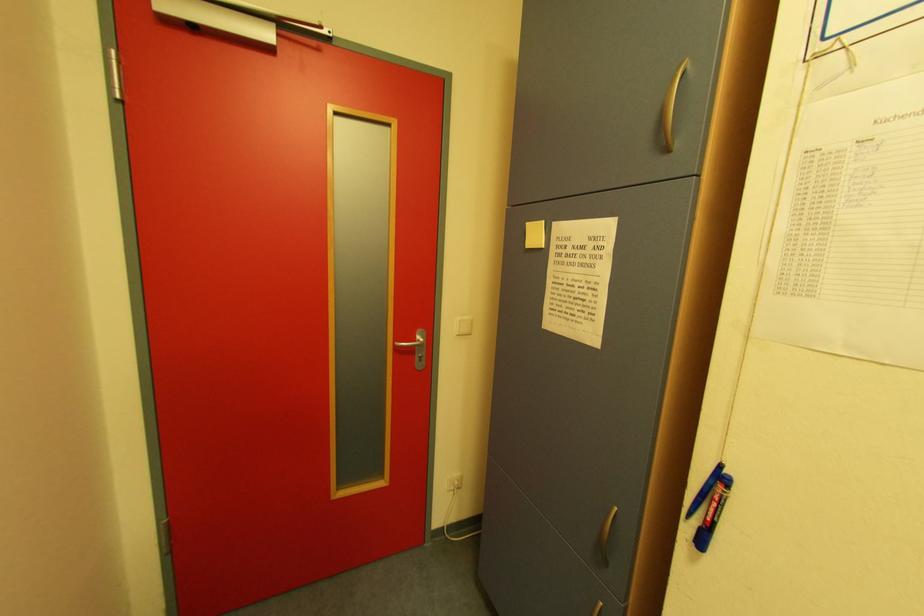
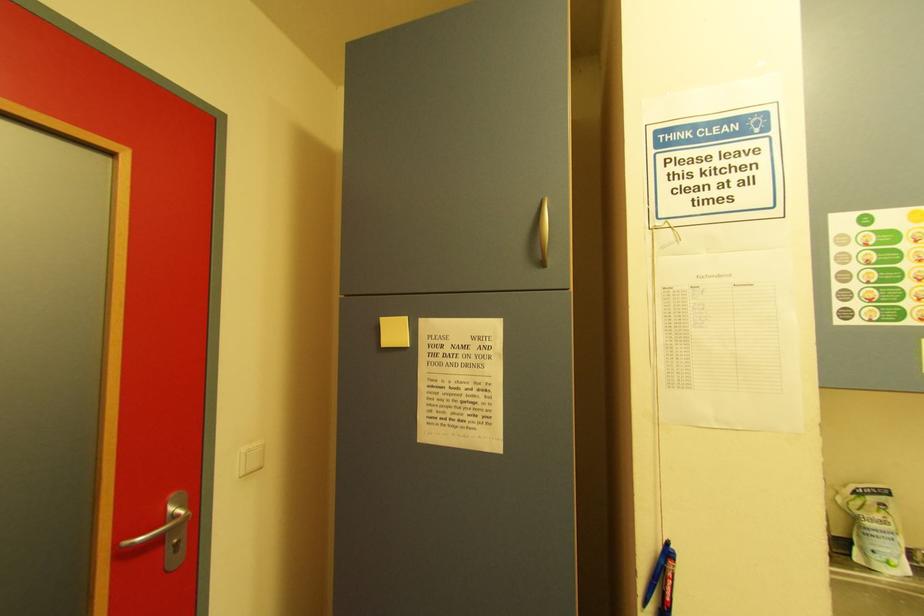
Question: The camera is either moving clockwise (left) or counter-clockwise (right) around the object. The first image is from the beginning of the video and the second image is from the end. Is the camera moving left or right when shooting the video?

Choices:
 (A) Left
 (B) Right

Answer: (A)